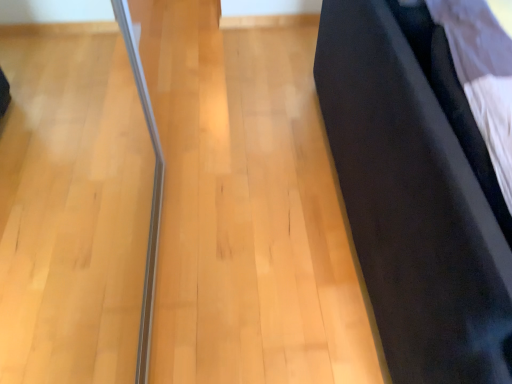
Question: Should I look upward or downward to see black matte curtain at right?

Choices:
 (A) up
 (B) down

Answer: (A)